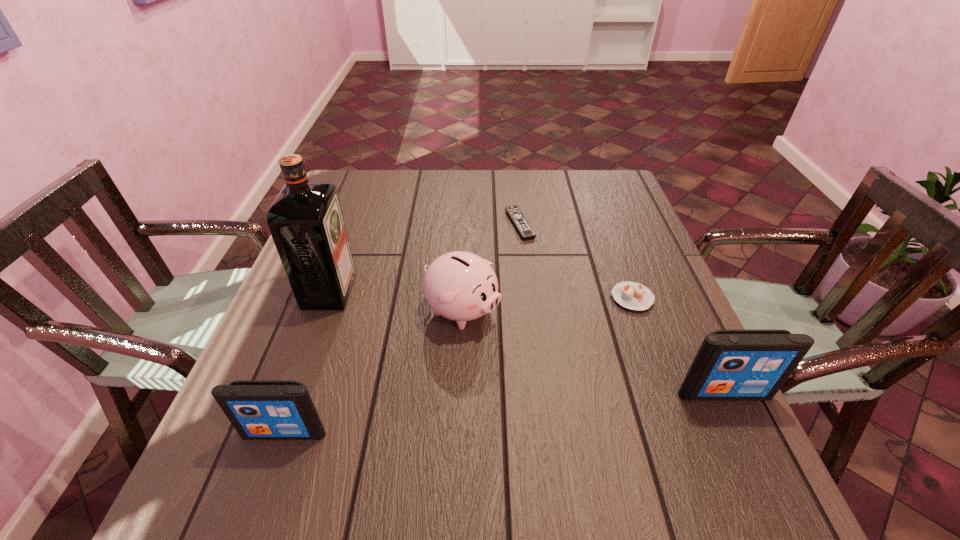
The image size is (960, 540). I want to click on free space located on the front label of the liquor, so click(x=485, y=291).

Find the location of a particular element. vacant area situated on the back of the piggy bank is located at coordinates (465, 251).

The height and width of the screenshot is (540, 960). I want to click on blank space located on the front of the cupcake, so click(x=657, y=363).

I want to click on object that is positioned at the far edge, so click(522, 225).

The width and height of the screenshot is (960, 540). What are the coordinates of `object that is positioned at the near edge` in the screenshot? It's located at (258, 409).

In order to click on iPod that is at the left edge in this screenshot , I will do `click(258, 409)`.

Where is `liquor at the left edge`? The height and width of the screenshot is (540, 960). liquor at the left edge is located at coordinates (306, 221).

Find the location of `iPod that is positioned at the right edge`. iPod that is positioned at the right edge is located at coordinates (731, 365).

Locate an element on the screen. cupcake located in the right edge section of the desktop is located at coordinates pyautogui.click(x=631, y=295).

This screenshot has height=540, width=960. I want to click on object present at the near left corner, so click(x=258, y=409).